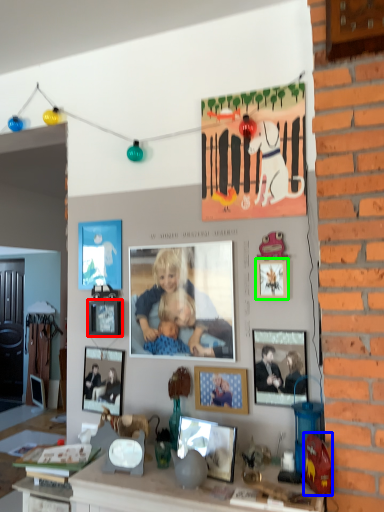
Question: Based on their relative distances, which object is nearer to picture frame (highlighted by a red box)? Choose from toy (highlighted by a blue box) and picture frame (highlighted by a green box).

Choices:
 (A) toy
 (B) picture frame

Answer: (B)